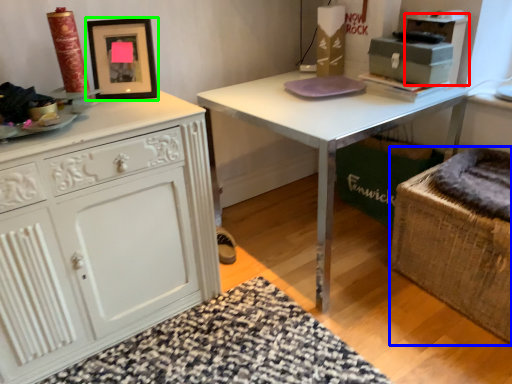
Question: Which is farther away from cabinetry (highlighted by a red box)? swivel chair (highlighted by a blue box) or picture frame (highlighted by a green box)?

Choices:
 (A) swivel chair
 (B) picture frame

Answer: (B)